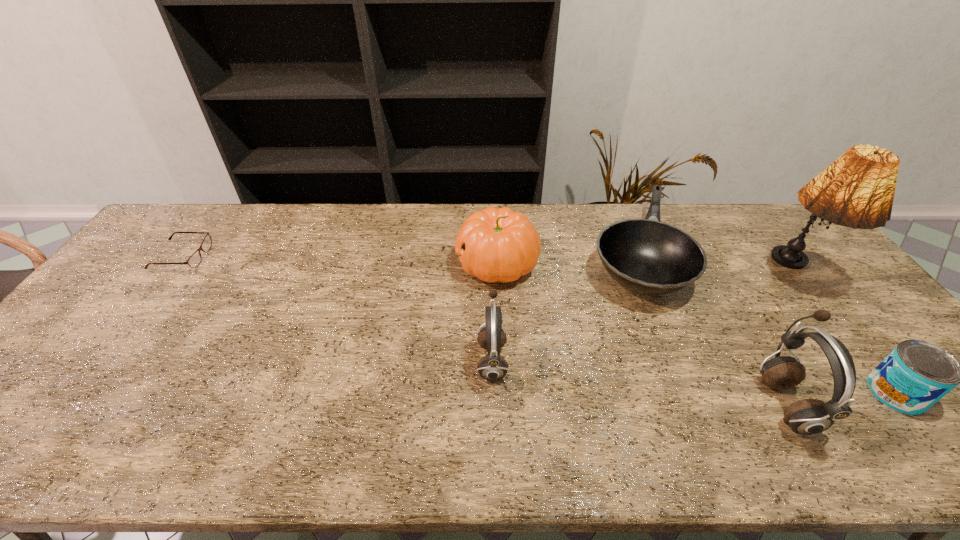
You are a GUI agent. You are given a task and a screenshot of the screen. Output one action in this format:
    pyautogui.click(x=<x>, y=<y>)
    Task: Click on the object situated at the near right corner
    
    Given the screenshot: What is the action you would take?
    pyautogui.click(x=916, y=374)

Locate an element on the screen. Image resolution: width=960 pixels, height=540 pixels. free space at the far edge of the desktop is located at coordinates (347, 225).

This screenshot has height=540, width=960. In the image, there is a desktop. In order to click on vacant area at the near edge in this screenshot , I will do `click(433, 411)`.

Where is `vacant space at the left edge`? vacant space at the left edge is located at coordinates (82, 357).

Locate an element on the screen. The height and width of the screenshot is (540, 960). free space at the right edge of the desktop is located at coordinates (852, 324).

Find the location of `free space at the far right corner`. free space at the far right corner is located at coordinates (775, 220).

Where is `blank region between the shortest object and the pumpkin`? blank region between the shortest object and the pumpkin is located at coordinates (340, 260).

Locate an element on the screen. Image resolution: width=960 pixels, height=540 pixels. free spot between the taller earphone and the left earphone is located at coordinates (638, 381).

The height and width of the screenshot is (540, 960). I want to click on free spot between the left earphone and the can, so click(x=694, y=376).

At what (x,y) coordinates should I click in order to perform the action: click on empty space between the pumpkin and the frying pan. Please return your answer as a coordinate pair (x, y). Image resolution: width=960 pixels, height=540 pixels. Looking at the image, I should click on (565, 260).